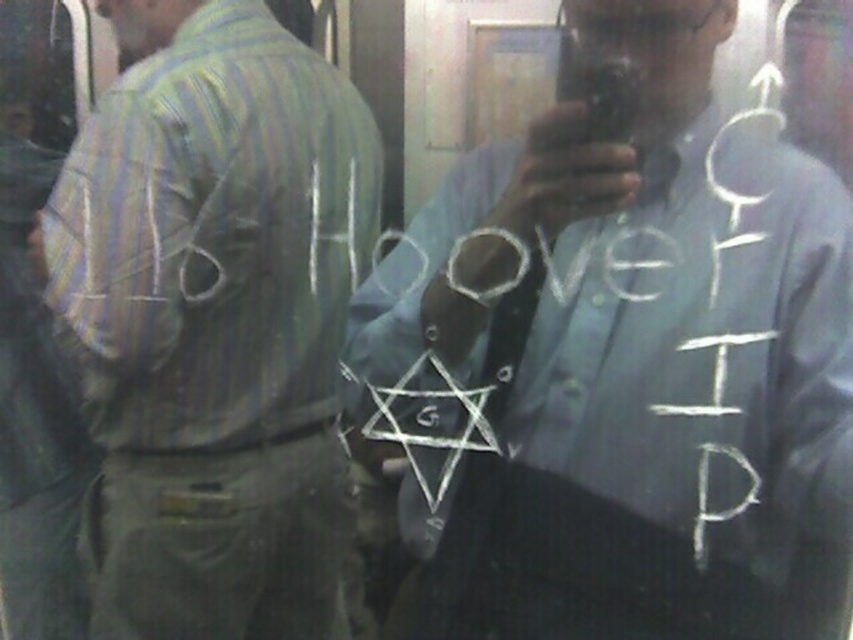
Question: Among these objects, which one is nearest to the camera?

Choices:
 (A) striped fabric shirt at left
 (B) light blue shirt at center

Answer: (B)

Question: Does light blue shirt at center have a smaller size compared to striped fabric shirt at left?

Choices:
 (A) yes
 (B) no

Answer: (B)

Question: Is light blue shirt at center above striped fabric shirt at left?

Choices:
 (A) yes
 (B) no

Answer: (B)

Question: Does light blue shirt at center have a larger size compared to striped fabric shirt at left?

Choices:
 (A) no
 (B) yes

Answer: (B)